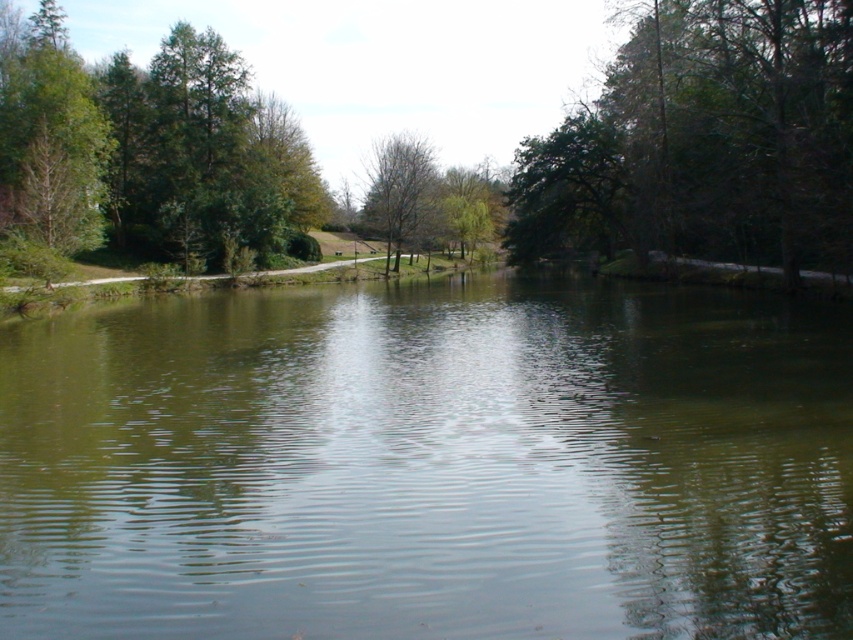
Does green matte tree at left appear under bare branches tree at center?

Yes.

Based on the photo, which is above, green matte tree at left or bare branches tree at center?

bare branches tree at center is higher up.

The height and width of the screenshot is (640, 853). In order to click on green matte tree at left in this screenshot , I will do `click(48, 134)`.

Which is above, green reflective water at center or green matte tree at left?

Positioned higher is green matte tree at left.

Which is behind, point (306, 502) or point (86, 83)?

The point (86, 83) is behind.

Between point (810, 580) and point (33, 90), which one is positioned in front?

Positioned in front is point (810, 580).

This screenshot has width=853, height=640. Find the location of `green reflective water at center`. green reflective water at center is located at coordinates point(430,464).

Does green leafy tree at left appear on the right side of bare branches tree at center?

In fact, green leafy tree at left is to the left of bare branches tree at center.

Does green leafy tree at left have a larger size compared to bare branches tree at center?

Yes, green leafy tree at left is bigger than bare branches tree at center.

Does point (258, 218) come closer to viewer compared to point (395, 211)?

Yes.

Identify the location of green leafy tree at left. The width and height of the screenshot is (853, 640). tap(148, 148).